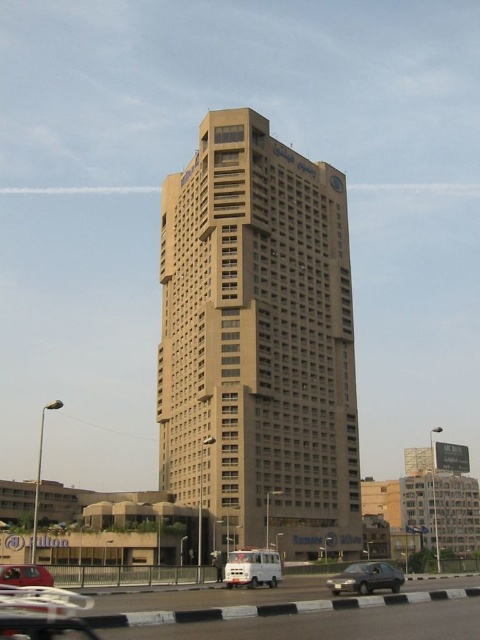
You are a delivery driver approaching the beige concrete building at center. You need to park your white matte van at center in a spot that is 10 meters wide. Can the van fit in the parking spot?

The beige concrete building at center might be wider than white matte van at center, so the van could potentially fit in the 10 meter wide parking spot, but there is uncertainty due to the building possibly being wider than the van.

You are a truck driver approaching the black asphalt highway at lower center and the white matte van at center. Which object is taller from your viewpoint?

The black asphalt highway at lower center is much taller than the white matte van at center.

You are a delivery driver needing to cross the black asphalt highway at lower center to reach the matte red car at lower left. Given that your truck requires a minimum of 12 meters to safely turn around, is the space between the highway and the car sufficient for your maneuver?

The distance between the black asphalt highway at lower center and the matte red car at lower left is 10.88 meters, which is less than the required 12 meters for a safe turn around. Therefore, the space is insufficient for your maneuver.